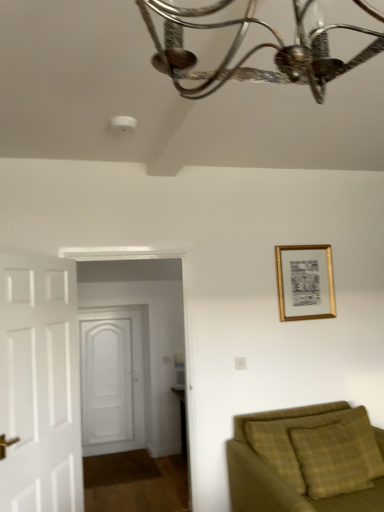
The width and height of the screenshot is (384, 512). Describe the element at coordinates (40, 384) in the screenshot. I see `white wooden door at left, acting as the 2th door starting from the back` at that location.

Image resolution: width=384 pixels, height=512 pixels. I want to click on white wooden door at center, which is the 2th door from front to back, so click(x=111, y=381).

What do you see at coordinates (111, 381) in the screenshot? The width and height of the screenshot is (384, 512). I see `white wooden door at center, marked as the first door in a back-to-front arrangement` at bounding box center [111, 381].

Where is `green plaid fabric couch at lower right`? The image size is (384, 512). green plaid fabric couch at lower right is located at coordinates (307, 460).

Is the surface of gold metallic picture frame at upper right in direct contact with white wooden door at center, marked as the first door in a back-to-front arrangement?

No, gold metallic picture frame at upper right is not in contact with white wooden door at center, marked as the first door in a back-to-front arrangement.

Considering the relative positions of gold metallic picture frame at upper right and white wooden door at center, which is the 2th door from front to back, in the image provided, is gold metallic picture frame at upper right to the right of white wooden door at center, which is the 2th door from front to back, from the viewer's perspective?

Yes, gold metallic picture frame at upper right is to the right of white wooden door at center, which is the 2th door from front to back.

Considering the relative sizes of gold metallic picture frame at upper right and white wooden door at center, marked as the first door in a back-to-front arrangement, in the image provided, is gold metallic picture frame at upper right thinner than white wooden door at center, marked as the first door in a back-to-front arrangement,?

Yes, gold metallic picture frame at upper right is thinner than white wooden door at center, marked as the first door in a back-to-front arrangement.

Based on the photo, is gold metallic picture frame at upper right oriented towards white wooden door at center, which is the 2th door from front to back?

No, gold metallic picture frame at upper right is not facing towards white wooden door at center, which is the 2th door from front to back.

Based on the photo, which point is more distant from viewer, (x=74, y=502) or (x=98, y=407)?

The point (x=98, y=407) is farther.

Are white wooden door at left, which ranks as the 1th door in front-to-back order, and white wooden door at center, marked as the first door in a back-to-front arrangement, beside each other?

white wooden door at left, which ranks as the 1th door in front-to-back order, and white wooden door at center, marked as the first door in a back-to-front arrangement, are clearly separated.

Locate an element on the screen. This screenshot has width=384, height=512. door behind the white wooden door at left, acting as the 2th door starting from the back is located at coordinates (x=111, y=381).

Which point is more forward, (122, 336) or (308, 291)?

The point (308, 291) is more forward.

From the image's perspective, is white wooden door at center, which is the 2th door from front to back, under gold metallic picture frame at upper right?

Yes, from the image's perspective, white wooden door at center, which is the 2th door from front to back, is below gold metallic picture frame at upper right.

Is white wooden door at center, marked as the first door in a back-to-front arrangement, in contact with gold metallic picture frame at upper right?

They are not placed beside each other.

From a real-world perspective, is white wooden door at center, marked as the first door in a back-to-front arrangement, positioned under gold metallic picture frame at upper right based on gravity?

Yes, from a real-world perspective, white wooden door at center, marked as the first door in a back-to-front arrangement, is below gold metallic picture frame at upper right.

Does green plaid fabric couch at lower right have a smaller size compared to gold metallic picture frame at upper right?

No, green plaid fabric couch at lower right is not smaller than gold metallic picture frame at upper right.

Is point (286, 423) positioned before point (314, 316)?

Yes, it is in front of point (314, 316).

Looking at this image, from a real-world perspective, relative to gold metallic picture frame at upper right, is green plaid fabric couch at lower right vertically above or below?

Clearly, from a real-world perspective, green plaid fabric couch at lower right is below gold metallic picture frame at upper right.

Would you say green plaid fabric couch at lower right is outside gold metallic picture frame at upper right?

Yes, green plaid fabric couch at lower right is outside of gold metallic picture frame at upper right.

Is point (324, 284) positioned behind point (72, 502)?

Yes, point (324, 284) is farther from viewer.

Is gold metallic picture frame at upper right positioned far away from white wooden door at left, acting as the 2th door starting from the back?

gold metallic picture frame at upper right is positioned a significant distance from white wooden door at left, acting as the 2th door starting from the back.

From the image's perspective, is gold metallic picture frame at upper right below white wooden door at left, which ranks as the 1th door in front-to-back order?

Actually, gold metallic picture frame at upper right appears above white wooden door at left, which ranks as the 1th door in front-to-back order, in the image.

Can you confirm if gold metallic picture frame at upper right is wider than white wooden door at left, which ranks as the 1th door in front-to-back order?

No, gold metallic picture frame at upper right is not wider than white wooden door at left, which ranks as the 1th door in front-to-back order.

From the image's perspective, is white wooden door at left, acting as the 2th door starting from the back, on top of gold metallic picture frame at upper right?

No, from the image's perspective, white wooden door at left, acting as the 2th door starting from the back, is not on top of gold metallic picture frame at upper right.

In the image, is white wooden door at left, which ranks as the 1th door in front-to-back order, positioned in front of or behind gold metallic picture frame at upper right?

Clearly, white wooden door at left, which ranks as the 1th door in front-to-back order, is in front of gold metallic picture frame at upper right.

Which is closer, (60, 468) or (285, 272)?

The point (60, 468) is in front.

How distant is white wooden door at left, acting as the 2th door starting from the back, from green plaid fabric couch at lower right?

white wooden door at left, acting as the 2th door starting from the back, is 1.37 meters from green plaid fabric couch at lower right.

Is white wooden door at left, acting as the 2th door starting from the back, facing towards green plaid fabric couch at lower right?

Yes, white wooden door at left, acting as the 2th door starting from the back, is facing green plaid fabric couch at lower right.

Considering the positions of objects white wooden door at left, which ranks as the 1th door in front-to-back order, and green plaid fabric couch at lower right in the image provided, who is in front, white wooden door at left, which ranks as the 1th door in front-to-back order, or green plaid fabric couch at lower right?

green plaid fabric couch at lower right.

Can you confirm if white wooden door at left, which ranks as the 1th door in front-to-back order, is shorter than green plaid fabric couch at lower right?

In fact, white wooden door at left, which ranks as the 1th door in front-to-back order, may be taller than green plaid fabric couch at lower right.

The image size is (384, 512). Find the location of `picture frame above the white wooden door at center, marked as the first door in a back-to-front arrangement (from a real-world perspective)`. picture frame above the white wooden door at center, marked as the first door in a back-to-front arrangement (from a real-world perspective) is located at coordinates (305, 282).

You are a GUI agent. You are given a task and a screenshot of the screen. Output one action in this format:
    pyautogui.click(x=<x>, y=<y>)
    Task: Click on the door on the right of white wooden door at center, which is the 2th door from front to back
    The width and height of the screenshot is (384, 512).
    Given the screenshot: What is the action you would take?
    pyautogui.click(x=40, y=384)

Considering their positions, is white wooden door at left, acting as the 2th door starting from the back, positioned further to gold metallic picture frame at upper right than white wooden door at center, which is the 2th door from front to back?

Based on the image, white wooden door at center, which is the 2th door from front to back, appears to be further to gold metallic picture frame at upper right.

From the image, which object appears to be nearer to green plaid fabric couch at lower right, white wooden door at left, acting as the 2th door starting from the back, or gold metallic picture frame at upper right?

gold metallic picture frame at upper right.

Considering their positions, is green plaid fabric couch at lower right positioned further to white wooden door at center, which is the 2th door from front to back, than white wooden door at left, acting as the 2th door starting from the back?

green plaid fabric couch at lower right is positioned further to the anchor white wooden door at center, which is the 2th door from front to back.

Which object lies further to the anchor point green plaid fabric couch at lower right, white wooden door at left, acting as the 2th door starting from the back, or white wooden door at center, which is the 2th door from front to back?

white wooden door at center, which is the 2th door from front to back, is positioned further to the anchor green plaid fabric couch at lower right.

Considering their positions, is green plaid fabric couch at lower right positioned closer to gold metallic picture frame at upper right than white wooden door at center, marked as the first door in a back-to-front arrangement?

green plaid fabric couch at lower right is positioned closer to the anchor gold metallic picture frame at upper right.

From the image, which object appears to be nearer to green plaid fabric couch at lower right, gold metallic picture frame at upper right or white wooden door at center, marked as the first door in a back-to-front arrangement?

gold metallic picture frame at upper right is positioned closer to the anchor green plaid fabric couch at lower right.

In the scene shown: When comparing their distances from green plaid fabric couch at lower right, does white wooden door at center, marked as the first door in a back-to-front arrangement, or white wooden door at left, acting as the 2th door starting from the back, seem further?

white wooden door at center, marked as the first door in a back-to-front arrangement, is further to green plaid fabric couch at lower right.

Looking at this image, looking at the image, which one is located closer to white wooden door at center, which is the 2th door from front to back, green plaid fabric couch at lower right or gold metallic picture frame at upper right?

Among the two, gold metallic picture frame at upper right is located nearer to white wooden door at center, which is the 2th door from front to back.

In order to click on picture frame between white wooden door at left, acting as the 2th door starting from the back, and white wooden door at center, which is the 2th door from front to back, from front to back in this screenshot , I will do `click(305, 282)`.

This screenshot has width=384, height=512. What are the coordinates of `picture frame between green plaid fabric couch at lower right and white wooden door at center, which is the 2th door from front to back, in the front-back direction` in the screenshot? It's located at (305, 282).

This screenshot has width=384, height=512. I want to click on picture frame located between white wooden door at left, acting as the 2th door starting from the back, and green plaid fabric couch at lower right in the left-right direction, so click(x=305, y=282).

Where is `door between green plaid fabric couch at lower right and white wooden door at center, which is the 2th door from front to back, along the z-axis`? door between green plaid fabric couch at lower right and white wooden door at center, which is the 2th door from front to back, along the z-axis is located at coordinates (40, 384).